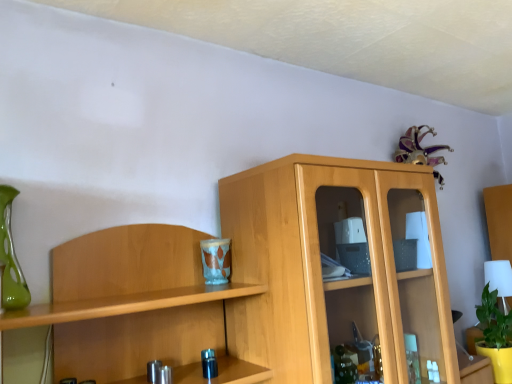
Find the location of a particular element. white fabric table lamp at right is located at coordinates (499, 279).

What do you see at coordinates (499, 279) in the screenshot?
I see `white fabric table lamp at right` at bounding box center [499, 279].

Measure the distance between point (488, 273) and camera.

Point (488, 273) and camera are 7.05 feet apart from each other.

Identify the location of white fabric table lamp at right. This screenshot has width=512, height=384. (499, 279).